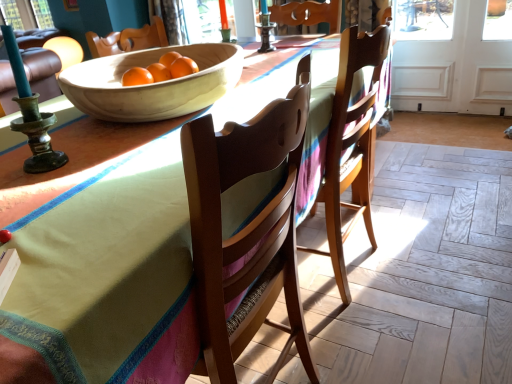
This screenshot has height=384, width=512. What are the coordinates of `free space to the back side of matte dark brown candle holder at upper center` in the screenshot? It's located at (278, 46).